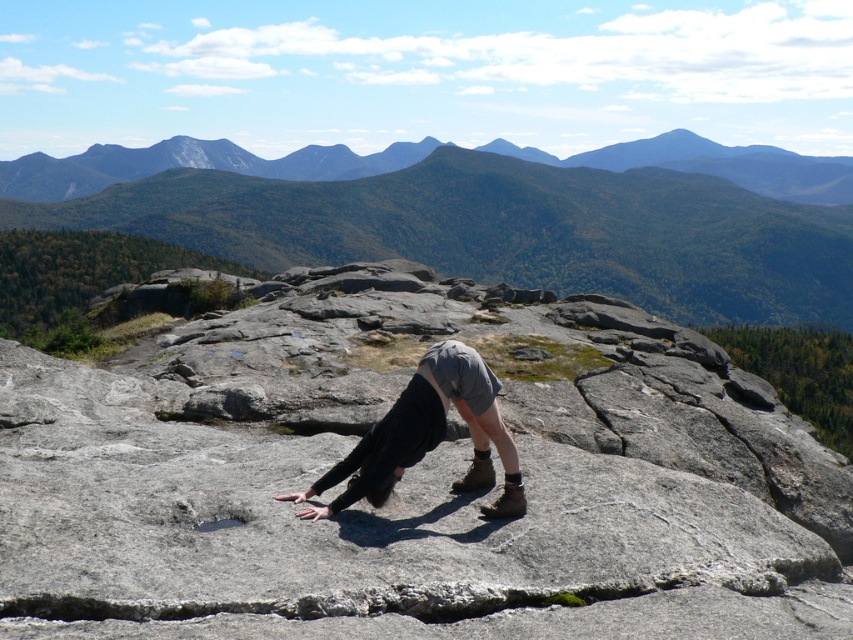
Question: Can you confirm if green grassy mountain at upper center is positioned above gray fabric pants at center?

Choices:
 (A) no
 (B) yes

Answer: (B)

Question: Estimate the real-world distances between objects in this image. Which object is farther from the green grassy mountain at upper center?

Choices:
 (A) gray rock at center
 (B) gray fabric pants at center

Answer: (B)

Question: Does green grassy mountain at upper center come in front of gray fabric pants at center?

Choices:
 (A) no
 (B) yes

Answer: (A)

Question: Among these objects, which one is farthest from the camera?

Choices:
 (A) green grassy mountain at upper center
 (B) gray fabric pants at center
 (C) gray rock at center

Answer: (A)

Question: Is gray rock at center behind green grassy mountain at upper center?

Choices:
 (A) no
 (B) yes

Answer: (A)

Question: Which of these objects is positioned farthest from the gray rock at center?

Choices:
 (A) gray fabric pants at center
 (B) green grassy mountain at upper center

Answer: (B)